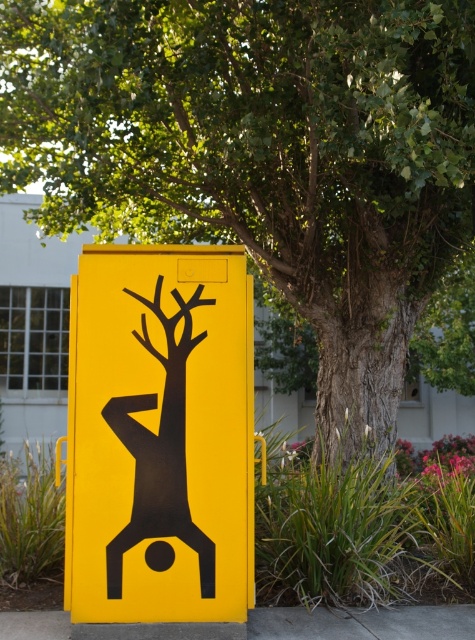
You are a delivery person trying to place a package on the ground near the matte yellow sign at center and the concrete at center. Which surface should you choose if you want to place it on the larger one?

The matte yellow sign at center is bigger than the concrete at center, so you should place the package on the matte yellow sign at center.

You are standing in front of the utility box and want to place a small potted plant between the matte yellow sign at center and the concrete at center. Based on their positions, which object should the plant be closer to?

The matte yellow sign at center is to the left of concrete at center, so the plant should be placed closer to the matte yellow sign at center to be between them.